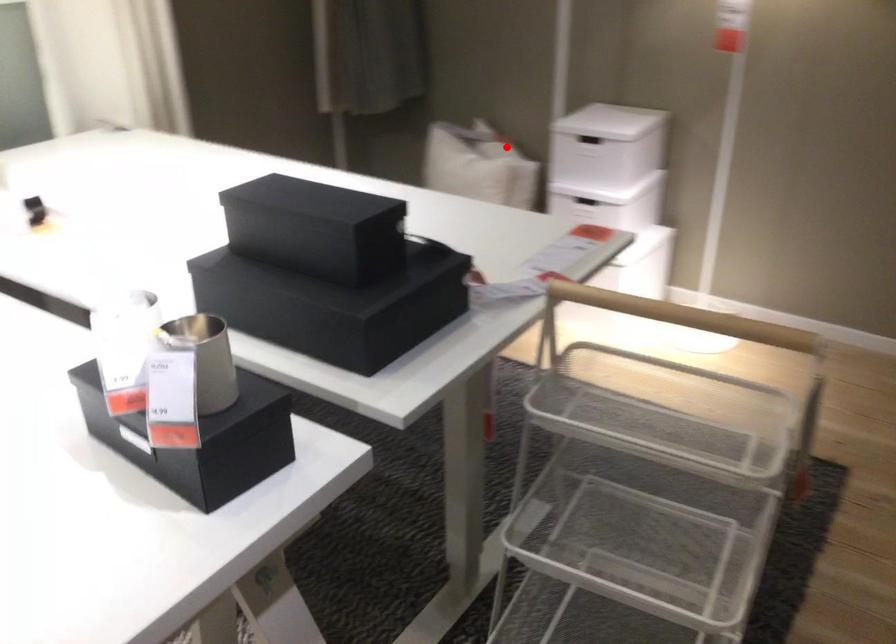
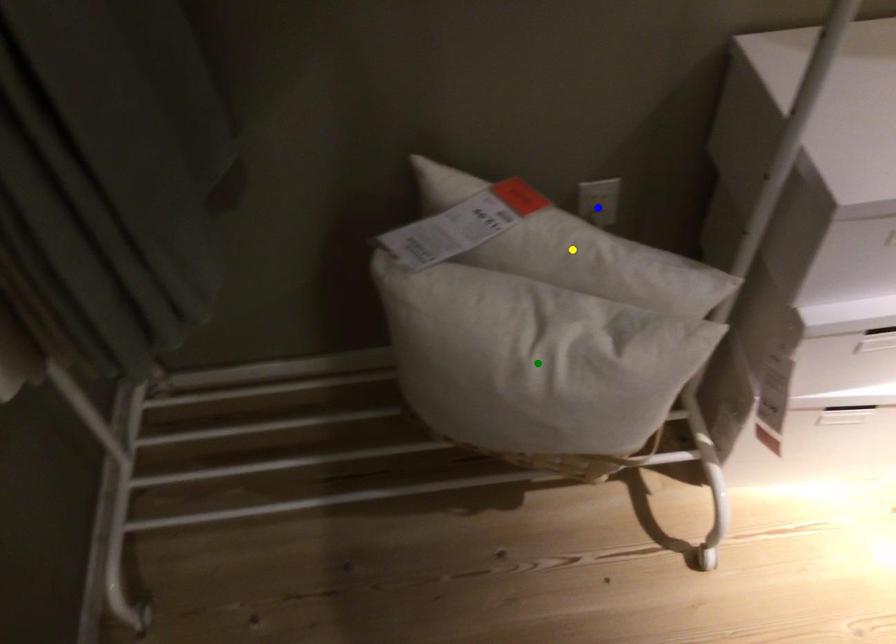
Question: I am providing you with two images of the same scene from different viewpoints. A red point is marked on the first image. You are given multiple points on the second image. Which point in image 2 represents the same 3d spot as the red point in image 1?

Choices:
 (A) blue point
 (B) green point
 (C) yellow point

Answer: (C)